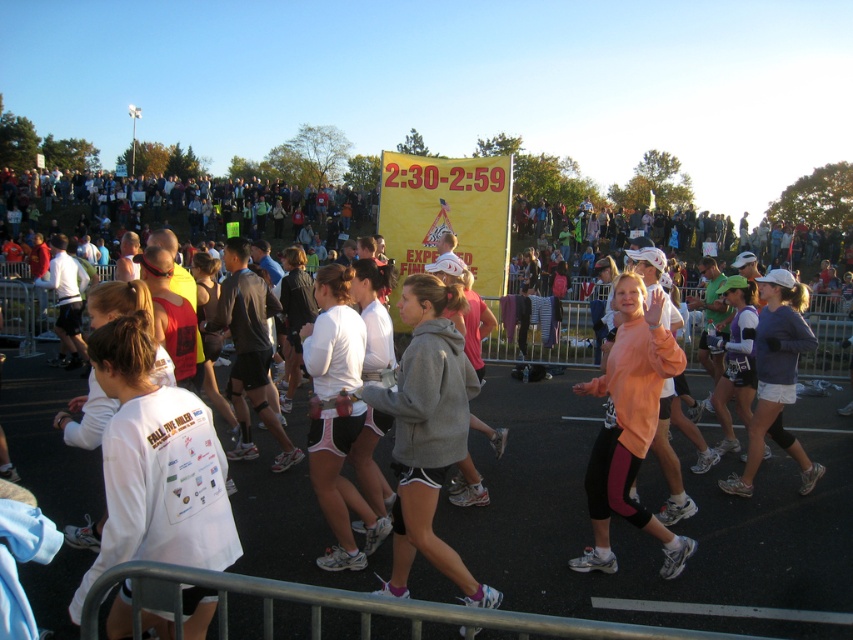
Is white matte shirt at center further to the viewer compared to pink matte leggings at center?

No, white matte shirt at center is closer to the viewer.

Who is positioned more to the right, white matte shirt at center or pink matte leggings at center?

Positioned to the right is pink matte leggings at center.

Is point (161, 634) farther from camera compared to point (589, 566)?

No.

This screenshot has width=853, height=640. Identify the location of white matte shirt at center. (155, 465).

Does white matte shirt at center have a lesser height compared to gray fleece sweatshirt at center?

Yes, white matte shirt at center is shorter than gray fleece sweatshirt at center.

Can you confirm if white matte shirt at center is bigger than gray fleece sweatshirt at center?

Incorrect, white matte shirt at center is not larger than gray fleece sweatshirt at center.

Between point (117, 490) and point (442, 552), which one is positioned behind?

The point (442, 552) is behind.

The image size is (853, 640). Find the location of `white matte shirt at center`. white matte shirt at center is located at coordinates (155, 465).

Is gray fleece sweatshirt at center bigger than pink matte leggings at center?

Actually, gray fleece sweatshirt at center might be smaller than pink matte leggings at center.

Is point (440, 440) less distant than point (599, 525)?

Yes, point (440, 440) is closer to viewer.

I want to click on gray fleece sweatshirt at center, so click(x=427, y=435).